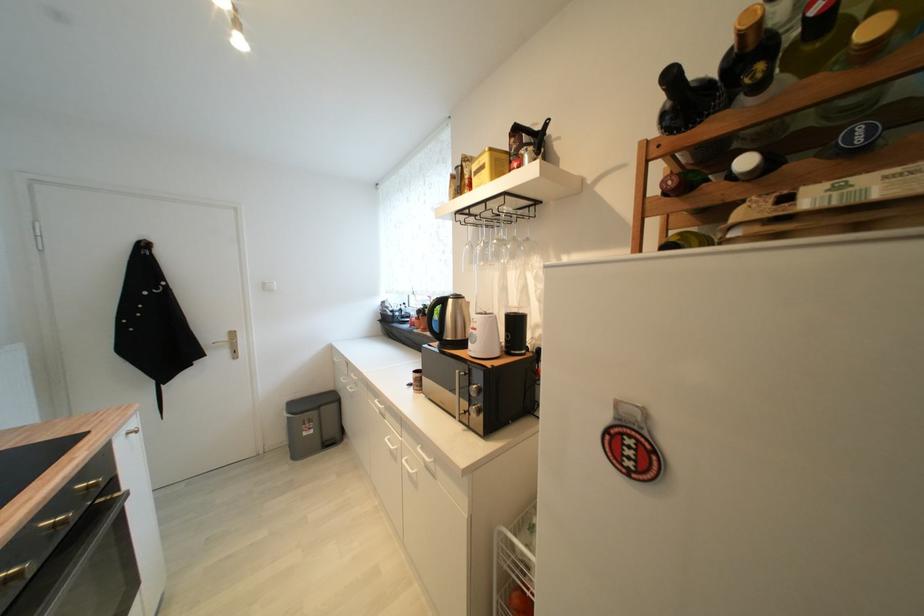
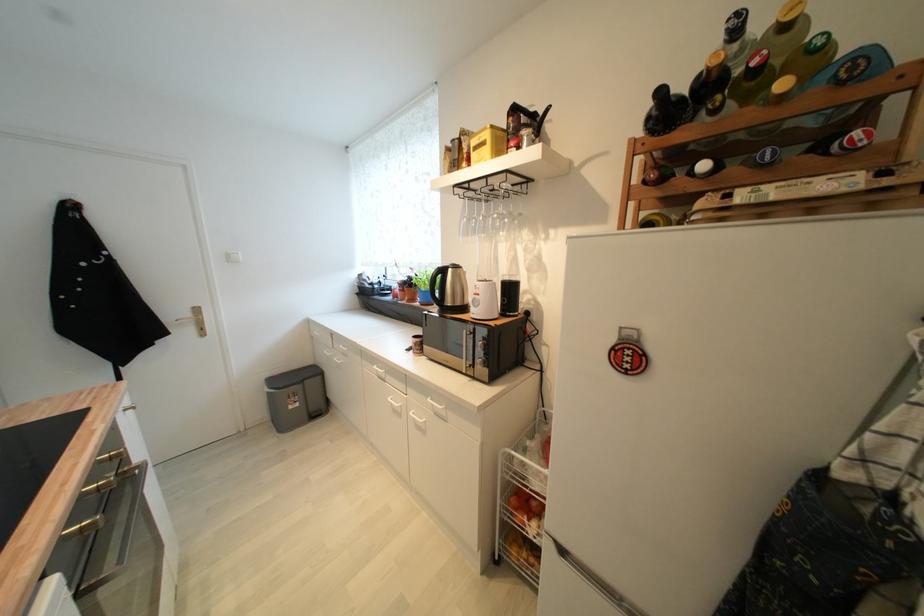
In the second image, find the point that corresponds to [310,436] in the first image.

(296, 408)